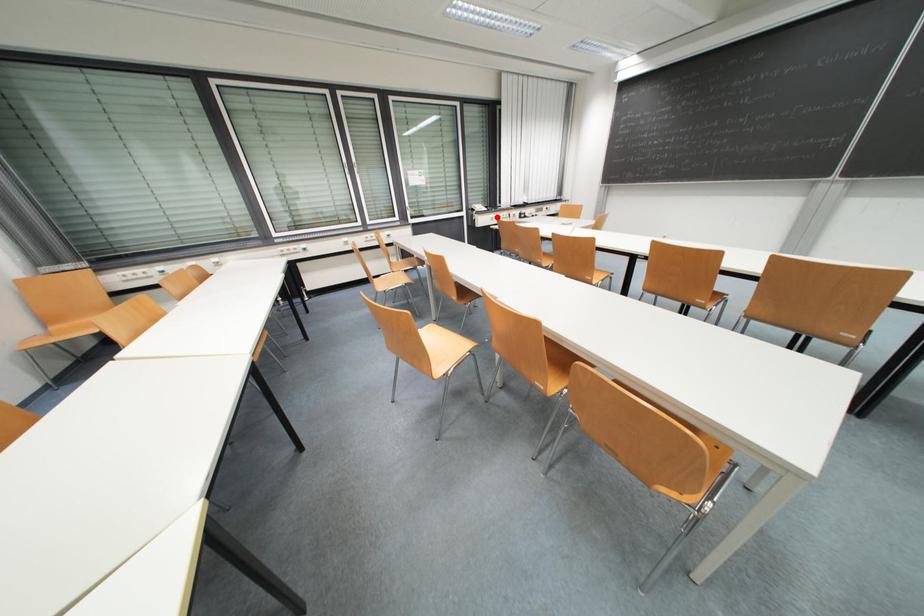
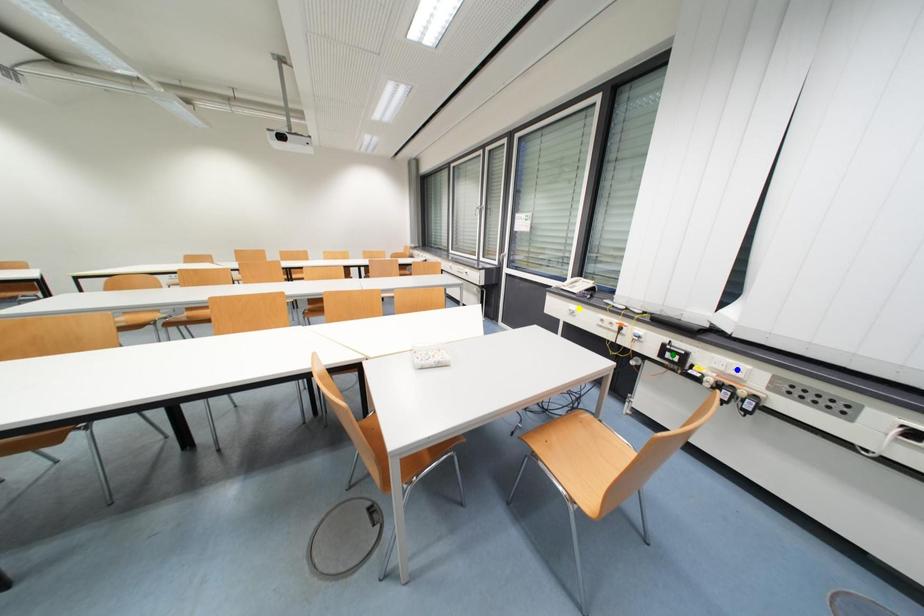
Question: I am providing you with two images of the same scene from different viewpoints. A red point is marked on the first image. You are given multiple points on the second image. Can you choose the point in image 2 that corresponds to the point in image 1?

Choices:
 (A) yellow point
 (B) green point
 (C) blue point

Answer: (A)